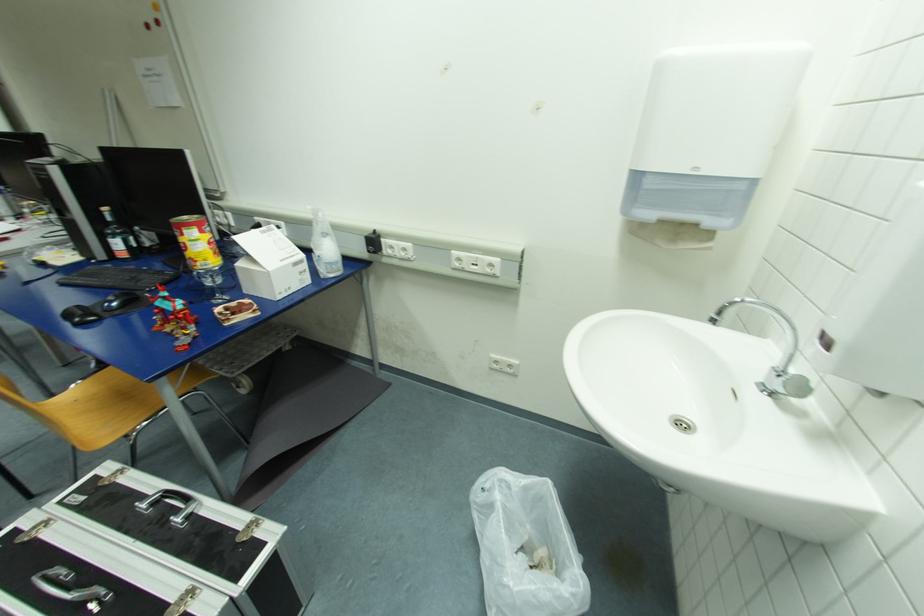
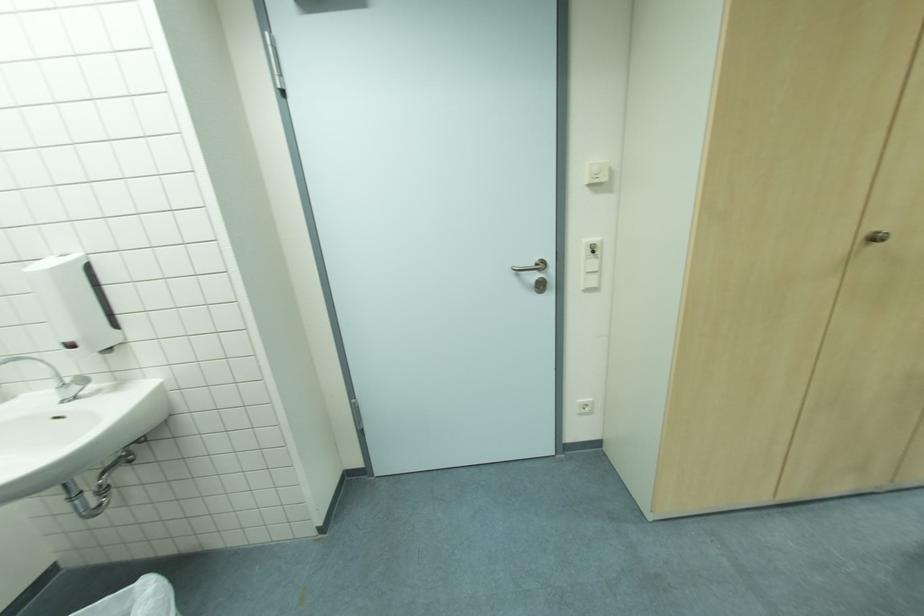
In the second image, find the point that corresponds to point 837,334 in the first image.

(71, 341)